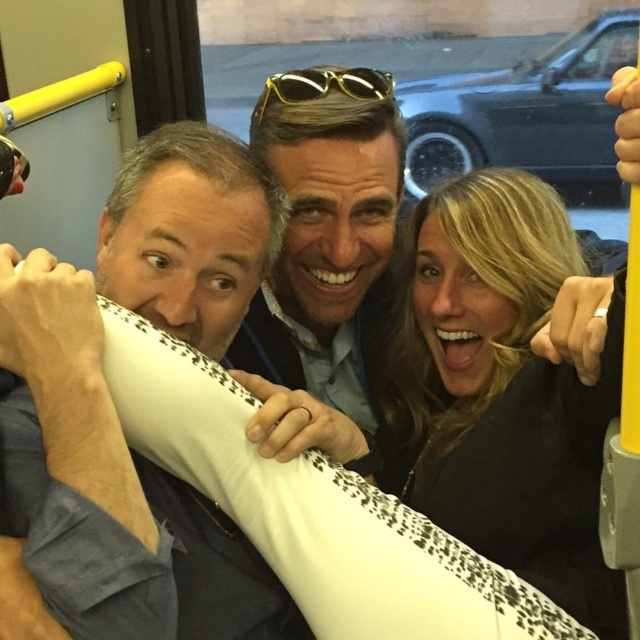
Question: Can you confirm if black matte surfboard at center is positioned to the left of gold metallic sunglasses at center?

Choices:
 (A) yes
 (B) no

Answer: (B)

Question: Which object is the farthest from the gold metallic sunglasses at center?

Choices:
 (A) matte blue shirt at left
 (B) black matte surfboard at center

Answer: (A)

Question: In this image, where is matte blue shirt at left located relative to black matte surfboard at center?

Choices:
 (A) left
 (B) right

Answer: (A)

Question: Which of the following is the closest to the observer?

Choices:
 (A) gold metallic sunglasses at center
 (B) matte blue shirt at left
 (C) black matte surfboard at center

Answer: (B)

Question: Considering the real-world distances, which object is closest to the gold metallic sunglasses at center?

Choices:
 (A) matte blue shirt at left
 (B) black matte surfboard at center

Answer: (B)

Question: Where is matte blue shirt at left located in relation to black matte surfboard at center in the image?

Choices:
 (A) above
 (B) below

Answer: (A)